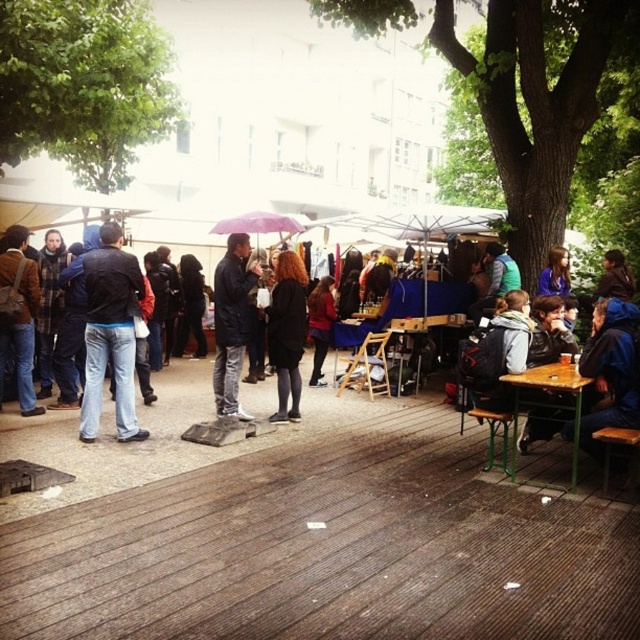
Question: Is matte black jacket at center above brown hair at center?

Choices:
 (A) yes
 (B) no

Answer: (B)

Question: Can you confirm if purple fabric umbrella at center is positioned to the left of brown hair at center?

Choices:
 (A) no
 (B) yes

Answer: (B)

Question: Which point appears closest to the camera in this image?

Choices:
 (A) pos(328,285)
 (B) pos(22,282)
 (C) pos(49,426)
 (D) pos(81,404)

Answer: (D)

Question: Which point is closer to the camera?

Choices:
 (A) (150, 460)
 (B) (522, 376)

Answer: (B)

Question: Among these points, which one is nearest to the camera?

Choices:
 (A) click(x=253, y=266)
 (B) click(x=273, y=339)

Answer: (A)

Question: Does green wooden table at lower right appear over brown hair at center?

Choices:
 (A) no
 (B) yes

Answer: (A)